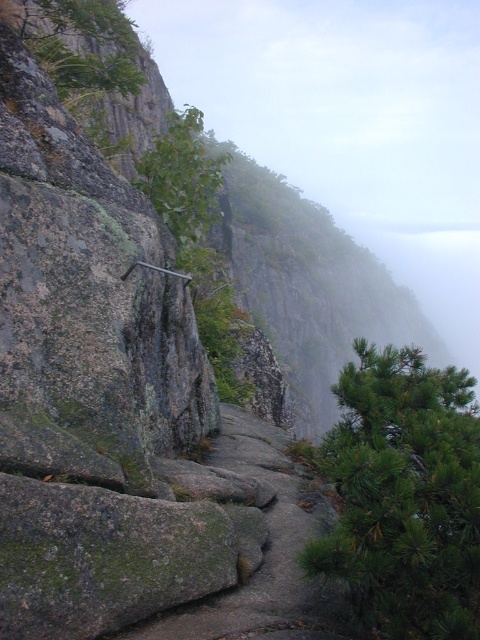
Question: In this image, where is green mossy rock at center located relative to green leafy tree at upper left?

Choices:
 (A) right
 (B) left

Answer: (A)

Question: Estimate the real-world distances between objects in this image. Which object is closer to the green mossy rock at center?

Choices:
 (A) green leafy tree at upper left
 (B) green needle-like tree at right

Answer: (B)

Question: Can you confirm if green needle-like tree at right is positioned below green leafy tree at upper left?

Choices:
 (A) yes
 (B) no

Answer: (A)

Question: Is green mossy rock at center below green leafy tree at upper left?

Choices:
 (A) no
 (B) yes

Answer: (B)

Question: Which object is closer to the camera taking this photo?

Choices:
 (A) green needle-like tree at right
 (B) green leafy tree at upper left
 (C) green mossy rock at center

Answer: (A)

Question: Estimate the real-world distances between objects in this image. Which object is farther from the green needle-like tree at right?

Choices:
 (A) green leafy tree at upper left
 (B) green mossy rock at center

Answer: (A)